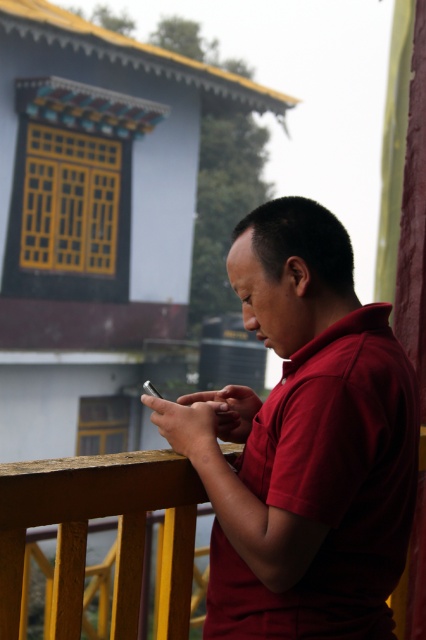
You are a photographer trying to capture a clear photo of the wooden railing at center without the matte red shirt at center blocking it. Based on their positions, is this possible?

The matte red shirt at center is positioned over the wooden railing at center, so taking a clear photo of the wooden railing at center without the shirt blocking it would require adjusting the angle or moving the shirt.

In the scene shown: You are a delivery robot with a package that needs to be handed to the person wearing the matte red shirt at center. The robot has a delivery arm that can extend up to 1.5 meters. Can the robot reach the person from its current position?

The matte red shirt at center and viewer are 1.56 meters apart. Since the delivery arm can only extend up to 1.5 meters, the robot cannot reach the person.